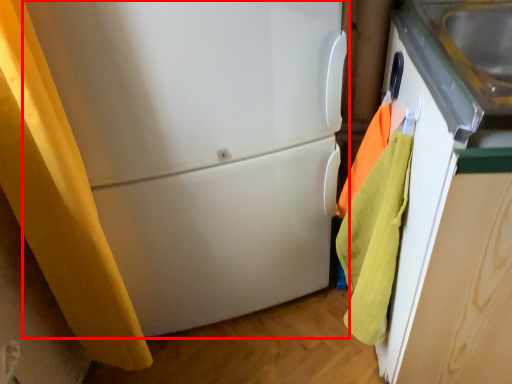
Question: Where is refrigerator (annotated by the red box) located in relation to beach towel in the image?

Choices:
 (A) left
 (B) right

Answer: (A)